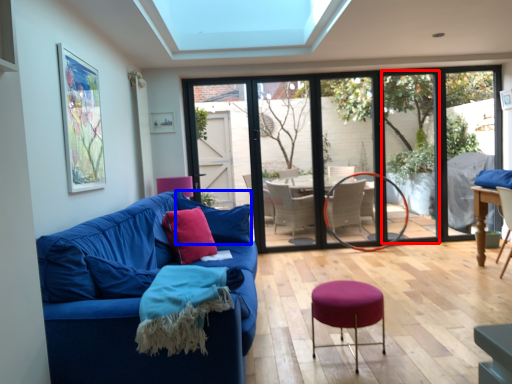
Question: Which object appears farthest to the camera in this image, window screen (highlighted by a red box) or pillow (highlighted by a blue box)?

Choices:
 (A) window screen
 (B) pillow

Answer: (A)